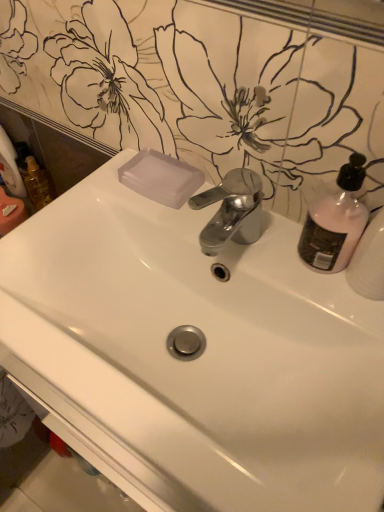
Question: Is translucent plastic soap at upper center in front of or behind white glossy sink at center in the image?

Choices:
 (A) behind
 (B) front

Answer: (A)

Question: Considering the positions of translucent plastic soap at upper center and white glossy sink at center in the image, is translucent plastic soap at upper center wider or thinner than white glossy sink at center?

Choices:
 (A) thin
 (B) wide

Answer: (A)

Question: Considering the real-world distances, which object is closest to the translucent plastic soap at upper center?

Choices:
 (A) white matte toilet paper at left
 (B) translucent plastic mouthwash at left
 (C) pink matte bottle at upper right
 (D) white glossy sink at center

Answer: (D)

Question: Estimate the real-world distances between objects in this image. Which object is farther from the white matte toilet paper at left?

Choices:
 (A) white glossy sink at center
 (B) translucent plastic soap at upper center
 (C) translucent plastic mouthwash at left
 (D) pink matte bottle at upper right

Answer: (D)